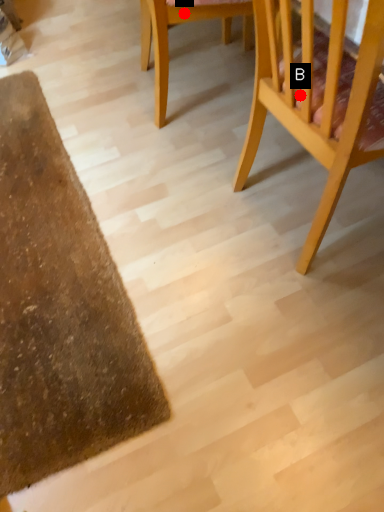
Question: Two points are circled on the image, labeled by A and B beside each circle. Which point is closer to the camera?

Choices:
 (A) A is closer
 (B) B is closer

Answer: (B)